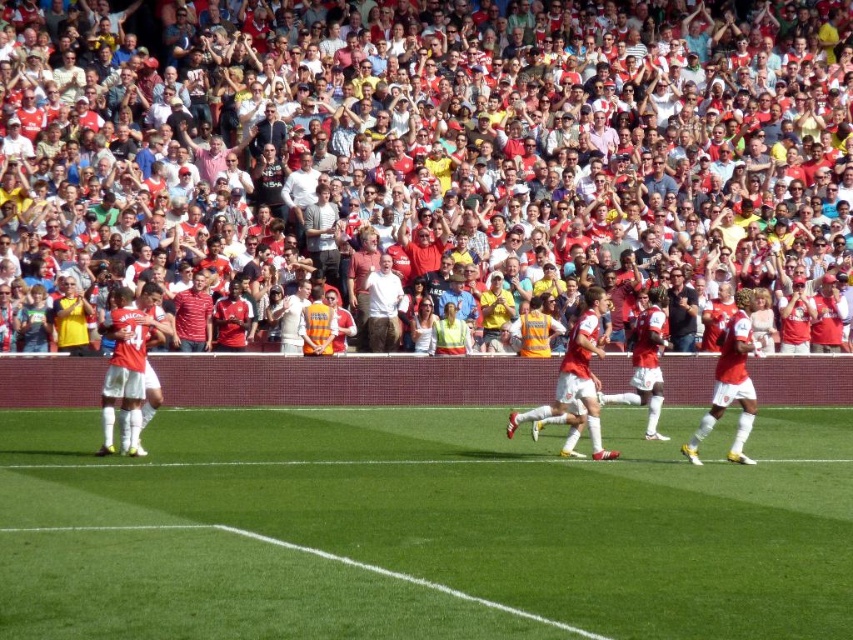
You are a drone operator trying to capture a closeup of the green grass at center. The stadium has a coordinate system where the bottom left corner is at point 0,0 and the top right corner is at point 1,1. What coordinates should you aim for to get the best shot?

The green grass at center is located at coordinates point (421,529), so aim for that point to capture the best closeup.

From the picture: You are a photographer standing at the origin point of the coordinate system. You want to take a photo of the red jersey fans at center. What are the coordinates where you should aim your camera?

The coordinates to aim your camera are at point (432, 157) to capture the red jersey fans at center.